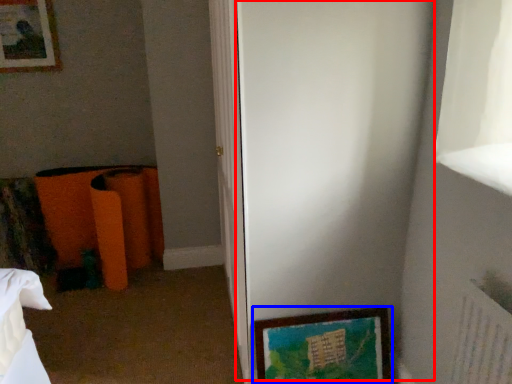
Question: Among these objects, which one is farthest to the camera, screen door (highlighted by a red box) or picture frame (highlighted by a blue box)?

Choices:
 (A) screen door
 (B) picture frame

Answer: (B)